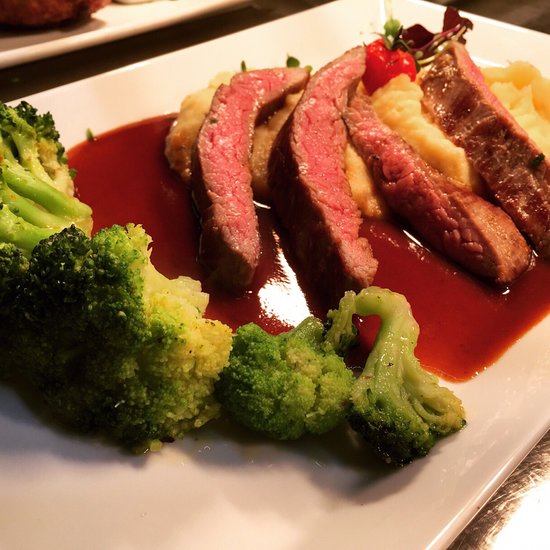
You are a GUI agent. You are given a task and a screenshot of the screen. Output one action in this format:
    pyautogui.click(x=<x>, y=<y>)
    Task: Click on the tabletop
    The height and width of the screenshot is (550, 550).
    Given the screenshot: What is the action you would take?
    pyautogui.click(x=500, y=525)